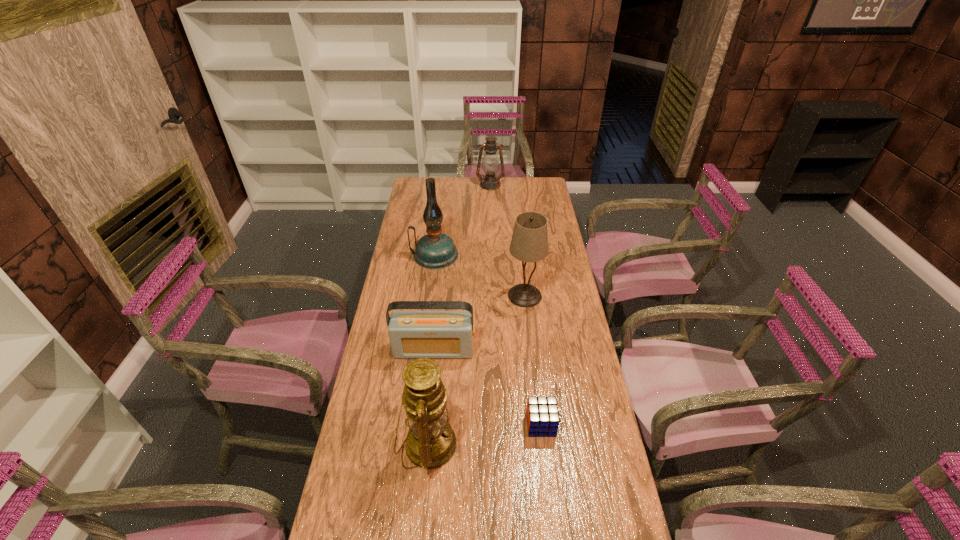
Locate an element on the screen. The height and width of the screenshot is (540, 960). vacant area that lies between the fourth nearest object and the shortest object is located at coordinates 533,360.

Identify the location of vacant space that is in between the third farthest object and the farthest object. (508, 240).

Point out which object is positioned as the fifth nearest to the second shortest object. Please provide its 2D coordinates. Your answer should be formatted as a tuple, i.e. [(x, y)], where the tuple contains the x and y coordinates of a point satisfying the conditions above.

[(490, 164)]

Identify which object is the second nearest to the fourth nearest object. Please provide its 2D coordinates. Your answer should be formatted as a tuple, i.e. [(x, y)], where the tuple contains the x and y coordinates of a point satisfying the conditions above.

[(436, 250)]

Identify the location of oil lamp that is the closest to the second nearest oil lamp. (490, 164).

Identify which oil lamp is the nearest to the lampshade. Please provide its 2D coordinates. Your answer should be formatted as a tuple, i.e. [(x, y)], where the tuple contains the x and y coordinates of a point satisfying the conditions above.

[(436, 250)]

This screenshot has height=540, width=960. What are the coordinates of `free space that satisfies the following two spatial constraints: 1. on the front side of the shortest object; 2. on the left side of the farthest oil lamp` in the screenshot? It's located at (498, 424).

Identify the location of vacant space that satisfies the following two spatial constraints: 1. on the front-facing side of the nearest oil lamp; 2. on the left side of the fourth farthest object. (424, 444).

Find the location of `free point that satisfies the following two spatial constraints: 1. on the back side of the nearest oil lamp; 2. on the right side of the farthest object`. free point that satisfies the following two spatial constraints: 1. on the back side of the nearest oil lamp; 2. on the right side of the farthest object is located at coordinates (452, 185).

I want to click on free point that satisfies the following two spatial constraints: 1. on the front-facing side of the radio receiver; 2. on the left side of the nearest oil lamp, so click(424, 444).